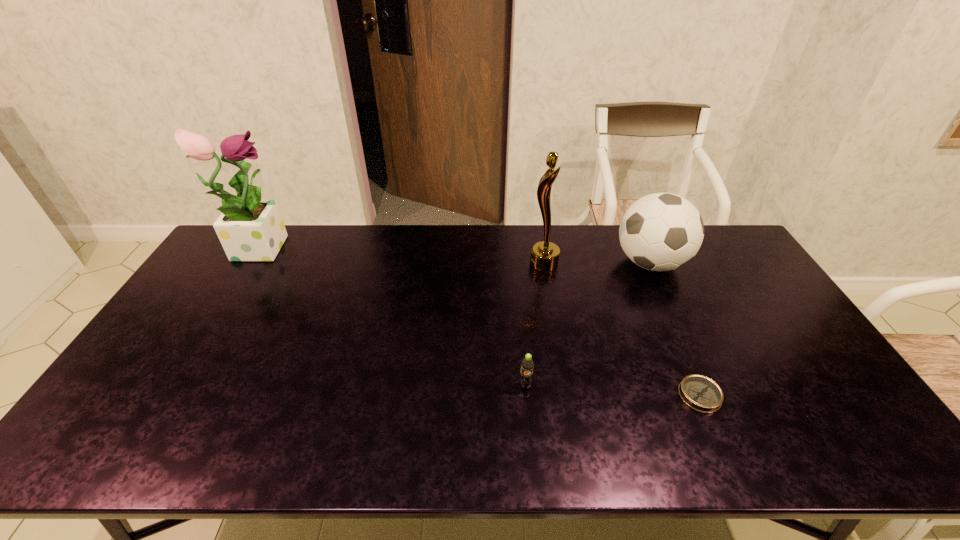
Where is `unoccupied area between the shortest object and the third shortest object`? unoccupied area between the shortest object and the third shortest object is located at coordinates (675, 329).

This screenshot has height=540, width=960. In order to click on free space that is in between the leftmost object and the soccer ball in this screenshot , I will do `click(455, 254)`.

Identify which object is the closest to the leftmost object. Please provide its 2D coordinates. Your answer should be formatted as a tuple, i.e. [(x, y)], where the tuple contains the x and y coordinates of a point satisfying the conditions above.

[(544, 256)]

Choose which object is the fourth nearest neighbor to the soda. Please provide its 2D coordinates. Your answer should be formatted as a tuple, i.e. [(x, y)], where the tuple contains the x and y coordinates of a point satisfying the conditions above.

[(250, 229)]

Identify the location of blank area in the image that satisfies the following two spatial constraints: 1. on the front-facing side of the leftmost object; 2. on the back side of the compass. (166, 395).

Where is `free spot that satisfies the following two spatial constraints: 1. on the back side of the third shortest object; 2. on the front-facing side of the leftmost object`? The image size is (960, 540). free spot that satisfies the following two spatial constraints: 1. on the back side of the third shortest object; 2. on the front-facing side of the leftmost object is located at coordinates (642, 246).

This screenshot has height=540, width=960. In order to click on vacant space that satisfies the following two spatial constraints: 1. on the front-facing side of the leftmost object; 2. on the back side of the third tallest object in this screenshot , I will do `click(249, 263)`.

Where is `free space that satisfies the following two spatial constraints: 1. on the front-facing side of the third object from right to left; 2. on the left side of the compass`? free space that satisfies the following two spatial constraints: 1. on the front-facing side of the third object from right to left; 2. on the left side of the compass is located at coordinates (566, 395).

Image resolution: width=960 pixels, height=540 pixels. In order to click on vacant space that satisfies the following two spatial constraints: 1. on the front-facing side of the award; 2. on the back side of the compass in this screenshot , I will do `click(566, 395)`.